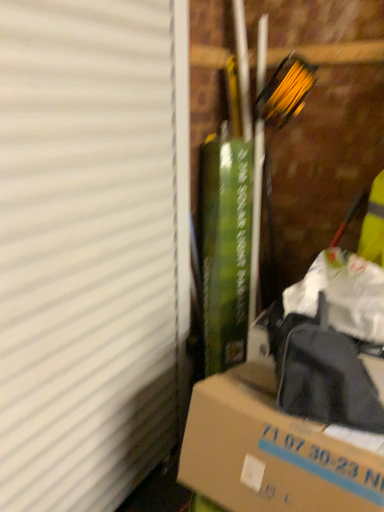
Question: Does white matte window screen at left have a smaller size compared to brown cardboard box at lower right?

Choices:
 (A) no
 (B) yes

Answer: (A)

Question: Considering the relative sizes of white matte window screen at left and brown cardboard box at lower right in the image provided, is white matte window screen at left thinner than brown cardboard box at lower right?

Choices:
 (A) no
 (B) yes

Answer: (B)

Question: Does white matte window screen at left have a greater width compared to brown cardboard box at lower right?

Choices:
 (A) yes
 (B) no

Answer: (B)

Question: Is white matte window screen at left looking in the opposite direction of brown cardboard box at lower right?

Choices:
 (A) no
 (B) yes

Answer: (B)

Question: Is white matte window screen at left placed right next to brown cardboard box at lower right?

Choices:
 (A) no
 (B) yes

Answer: (A)

Question: Is white matte window screen at left not within brown cardboard box at lower right?

Choices:
 (A) yes
 (B) no

Answer: (A)

Question: Is there a large distance between brown cardboard box at lower right and white matte window screen at left?

Choices:
 (A) no
 (B) yes

Answer: (A)

Question: Is brown cardboard box at lower right in front of white matte window screen at left?

Choices:
 (A) no
 (B) yes

Answer: (A)

Question: Does brown cardboard box at lower right have a greater height compared to white matte window screen at left?

Choices:
 (A) yes
 (B) no

Answer: (B)

Question: From the image's perspective, does brown cardboard box at lower right appear higher than white matte window screen at left?

Choices:
 (A) yes
 (B) no

Answer: (B)

Question: Is the depth of brown cardboard box at lower right greater than that of white matte window screen at left?

Choices:
 (A) yes
 (B) no

Answer: (A)

Question: Considering the relative positions of brown cardboard box at lower right and white matte window screen at left in the image provided, is brown cardboard box at lower right to the left of white matte window screen at left from the viewer's perspective?

Choices:
 (A) no
 (B) yes

Answer: (A)

Question: From a real-world perspective, is brown cardboard box at lower right positioned above or below white matte window screen at left?

Choices:
 (A) below
 (B) above

Answer: (A)